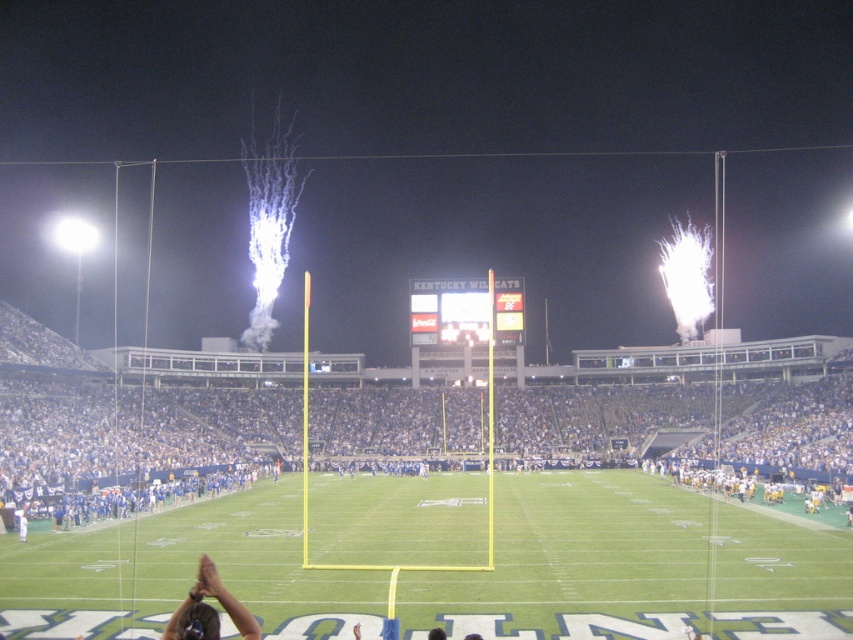
Who is taller, green artificial turf at center or dark brown hair at lower left?

dark brown hair at lower left is taller.

Between point (271, 525) and point (241, 624), which one is positioned in front?

Positioned in front is point (241, 624).

I want to click on green artificial turf at center, so click(637, 566).